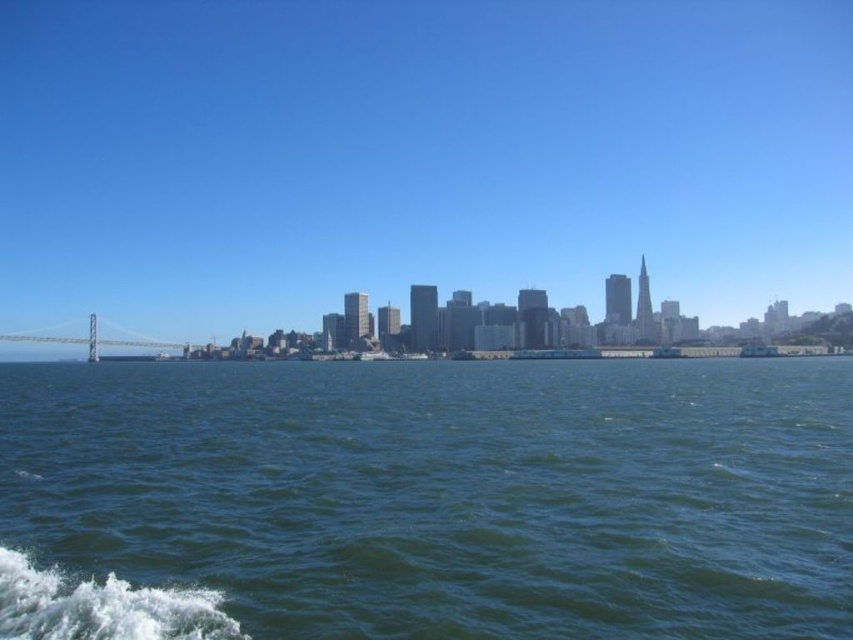
Question: Which of the following is the farthest from the observer?

Choices:
 (A) (476, 500)
 (B) (621, 108)
 (C) (3, 333)

Answer: (B)

Question: Which of these objects is positioned farthest from the metallic gray bridge at left?

Choices:
 (A) green water at center
 (B) blue sky at upper center

Answer: (A)

Question: Does green water at center have a larger size compared to metallic gray bridge at left?

Choices:
 (A) yes
 (B) no

Answer: (B)

Question: Does green water at center appear on the left side of metallic gray bridge at left?

Choices:
 (A) no
 (B) yes

Answer: (A)

Question: Which point is closer to the camera taking this photo?

Choices:
 (A) (125, 330)
 (B) (35, 336)

Answer: (B)

Question: Is blue sky at upper center positioned in front of metallic gray bridge at left?

Choices:
 (A) no
 (B) yes

Answer: (A)